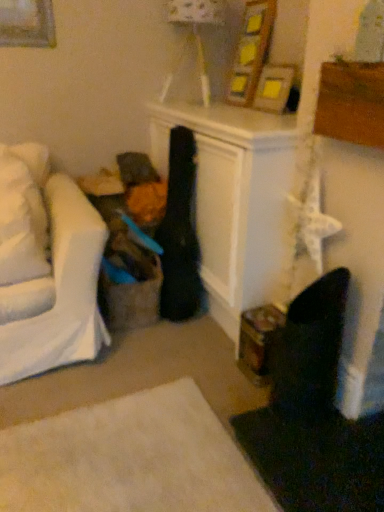
Question: Based on their positions, is wooden picture frame at upper center located to the left or right of white soft pillow at left?

Choices:
 (A) left
 (B) right

Answer: (B)

Question: From the image's perspective, is wooden picture frame at upper center located above or below white soft pillow at left?

Choices:
 (A) below
 (B) above

Answer: (B)

Question: Which is farther from the white soft pillow at left?

Choices:
 (A) wooden picture frame at upper center
 (B) matte white lampshade at upper center

Answer: (A)

Question: Based on their relative distances, which object is farther from the white soft pillow at left?

Choices:
 (A) matte white lampshade at upper center
 (B) wooden picture frame at upper center

Answer: (B)